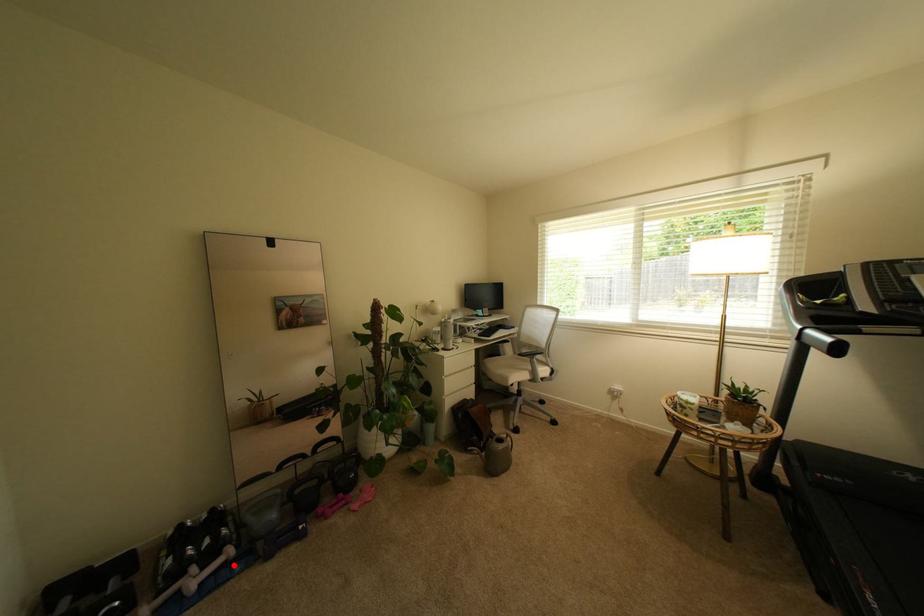
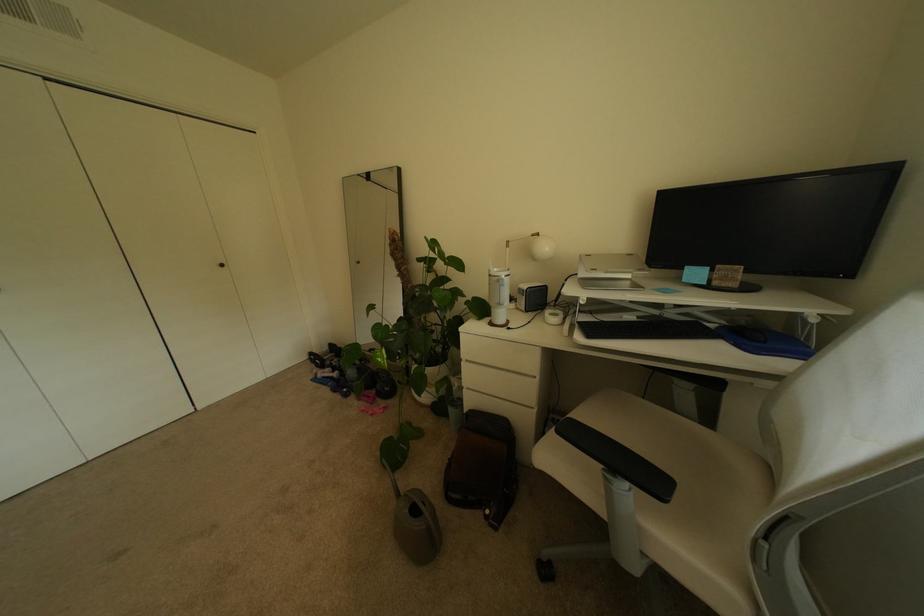
Question: A red point is marked in image1. In image2, is the corresponding 3D point closer to the camera or farther? Reply with the corresponding letter.

Choices:
 (A) The corresponding 3D point is closer.
 (B) The corresponding 3D point is farther.

Answer: (B)